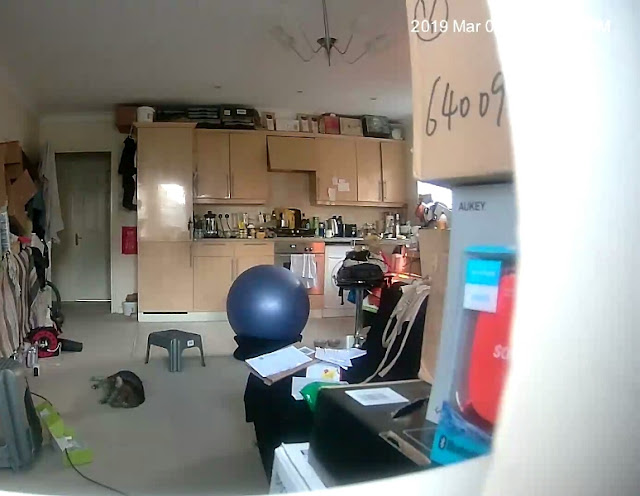
Find the location of `large yoga ball`. large yoga ball is located at coordinates (257, 315).